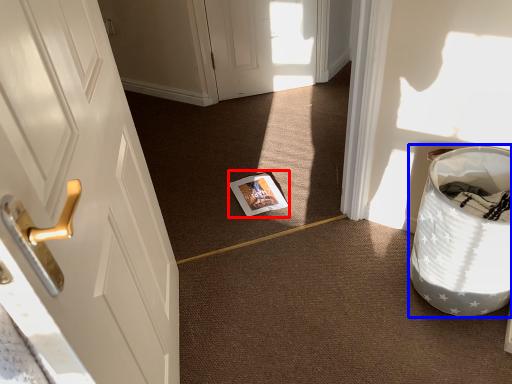
Question: Among these objects, which one is farthest to the camera, magazine (highlighted by a red box) or laundry basket (highlighted by a blue box)?

Choices:
 (A) magazine
 (B) laundry basket

Answer: (A)